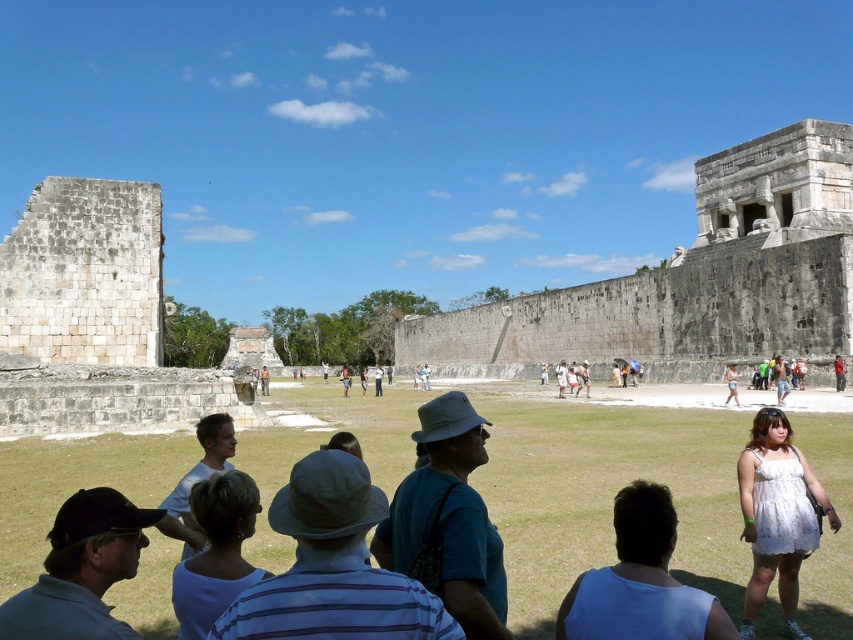
Question: Can you confirm if white lace dress at center is positioned to the right of white cotton dress at lower right?

Choices:
 (A) no
 (B) yes

Answer: (A)

Question: Which object is closer to the camera taking this photo?

Choices:
 (A) blue cotton shirt at center
 (B) matte blue shirt at lower left
 (C) dark blue shirt at center

Answer: (B)

Question: Which object is farther from the camera taking this photo?

Choices:
 (A) white fabric hat at center
 (B) white matte shirt at center
 (C) white lace dress at center
 (D) dark blue shirt at center

Answer: (C)

Question: Does white matte shirt at center have a smaller size compared to white cotton shirt at center?

Choices:
 (A) yes
 (B) no

Answer: (A)

Question: Does white fabric hat at center appear under white cotton dress at center-right?

Choices:
 (A) no
 (B) yes

Answer: (B)

Question: Among these objects, which one is nearest to the camera?

Choices:
 (A) white cotton dress at lower right
 (B) white matte shirt at center
 (C) white fabric hat at center

Answer: (C)